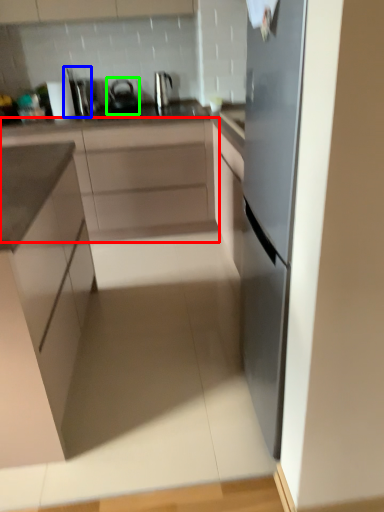
Question: Which object is the closest to the cabinetry (highlighted by a red box)? Choose among these: appliance (highlighted by a blue box) or tea pot (highlighted by a green box).

Choices:
 (A) appliance
 (B) tea pot

Answer: (B)